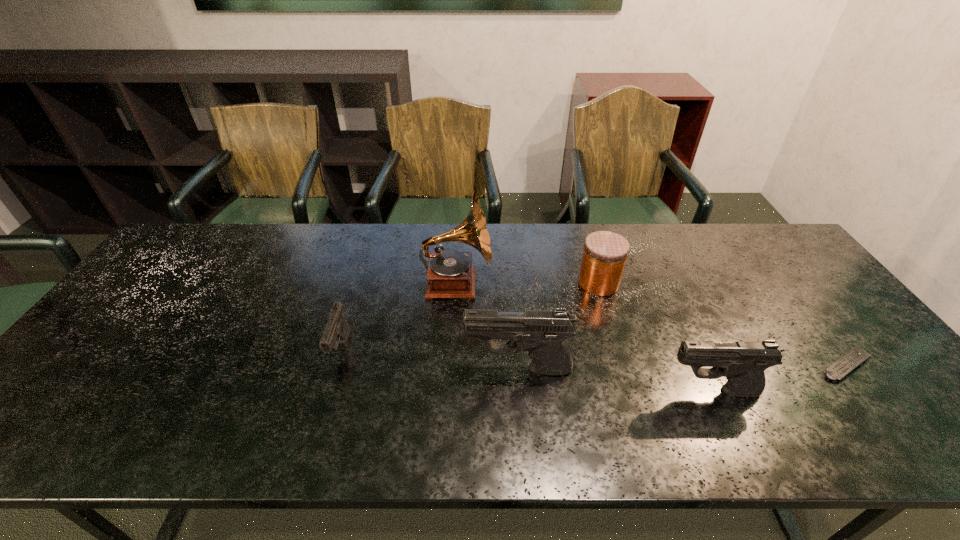
Image resolution: width=960 pixels, height=540 pixels. Find the location of `blank area in the image that satisfies the following two spatial constraints: 1. on the horn of the tallest object; 2. at the barrel of the leftmost object`. blank area in the image that satisfies the following two spatial constraints: 1. on the horn of the tallest object; 2. at the barrel of the leftmost object is located at coordinates (453, 349).

Where is `free region that satisfies the following two spatial constraints: 1. on the back side of the shortest object; 2. on the horn of the tallest object`? The width and height of the screenshot is (960, 540). free region that satisfies the following two spatial constraints: 1. on the back side of the shortest object; 2. on the horn of the tallest object is located at coordinates (782, 283).

You are a GUI agent. You are given a task and a screenshot of the screen. Output one action in this format:
    pyautogui.click(x=<x>, y=<y>)
    Task: Click on the free spot that satisfies the following two spatial constraints: 1. on the horn of the phonograph_record; 2. at the barrel of the fifth tallest object
    The width and height of the screenshot is (960, 540).
    Given the screenshot: What is the action you would take?
    pyautogui.click(x=453, y=349)

The image size is (960, 540). What are the coordinates of `free space that satisfies the following two spatial constraints: 1. on the horn of the phonograph_record; 2. on the right side of the remote control` in the screenshot? It's located at (452, 365).